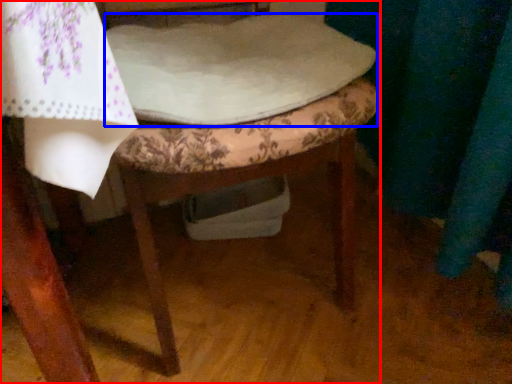
Question: Which object appears farthest to the camera in this image, chair (highlighted by a red box) or sheet (highlighted by a blue box)?

Choices:
 (A) chair
 (B) sheet

Answer: (B)